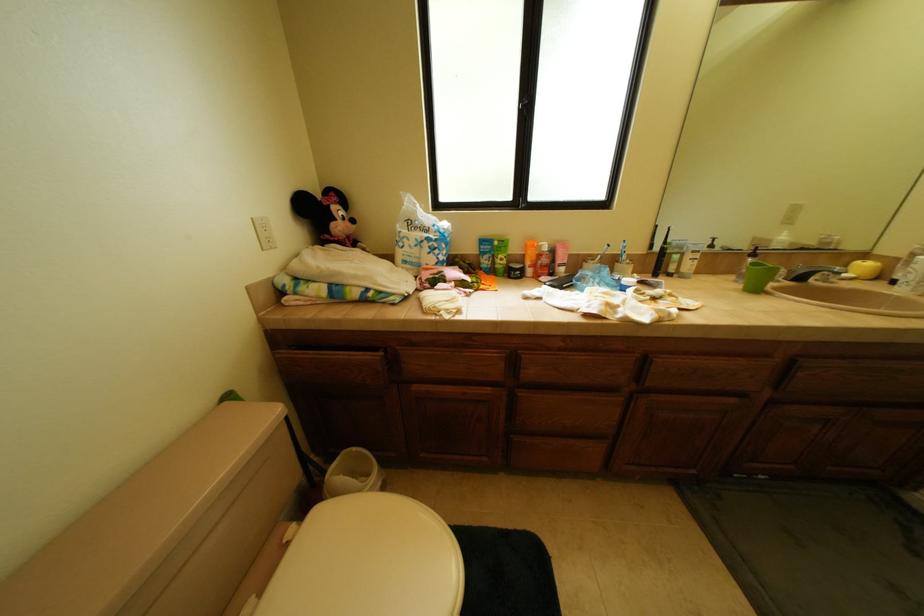
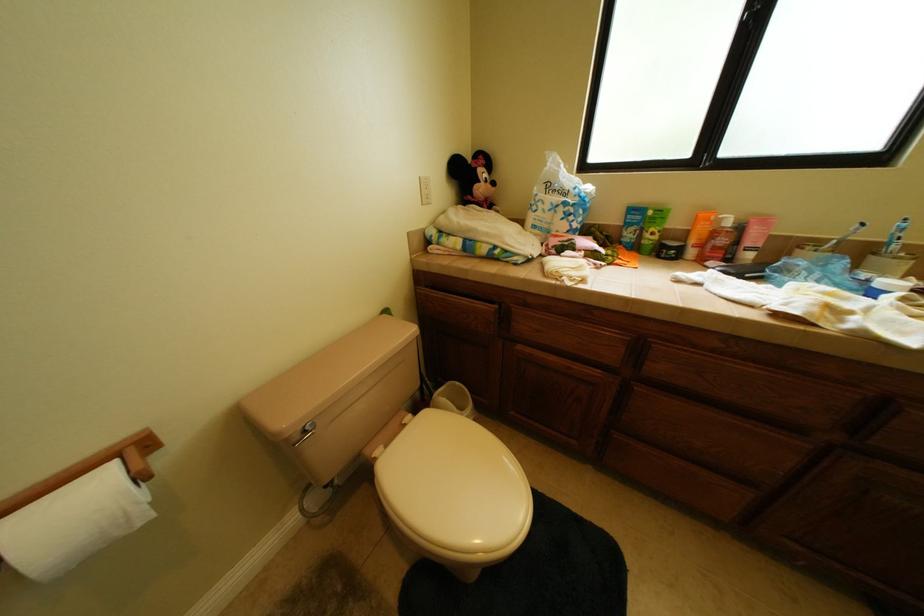
Question: In a continuous first-person perspective shot, in which direction is the camera moving?

Choices:
 (A) Left
 (B) Right
 (C) Forward
 (D) Backward

Answer: (D)